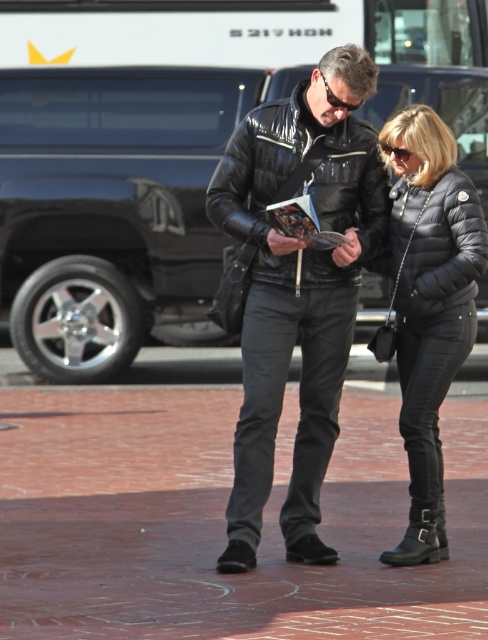
You are a photographer standing at the back of the scene. You want to take a photo of both the black leather jacket at center and the black quilted jacket at center so that both are fully visible. Which jacket should you position closer to the camera to ensure the other doesn t block it?

The black leather jacket at center is much taller than the black quilted jacket at center, so you should position the black leather jacket at center closer to the camera to prevent it from blocking the shorter black quilted jacket at center.

You are standing at the point with coordinates point (x=353, y=305) and want to walk towards the point with coordinates point (x=414, y=468). Which direction should you turn to reach the point?

Since point (x=353, y=305) is closer to you than point (x=414, y=468), you should turn towards the point (x=414, y=468) to reach it.